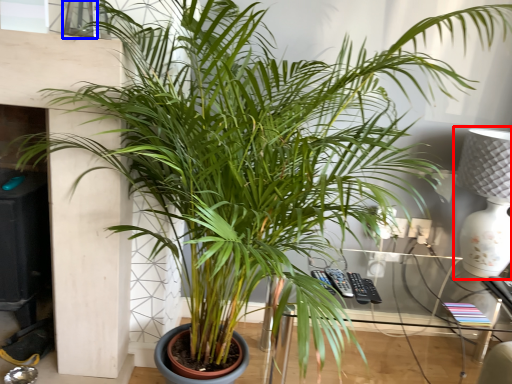
Question: Which of the following is the closest to the observer, table lamp (highlighted by a red box) or window (highlighted by a blue box)?

Choices:
 (A) table lamp
 (B) window

Answer: (B)